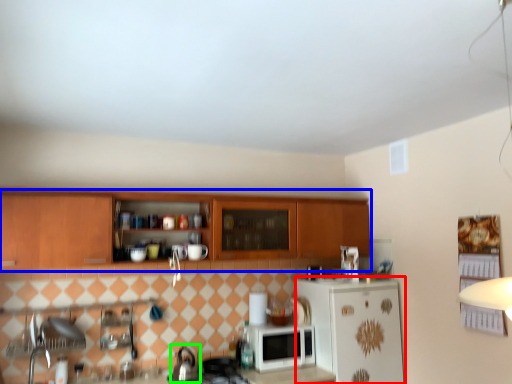
Question: Which is farther away from refrigerator (highlighted by a red box)? cabinetry (highlighted by a blue box) or tea pot (highlighted by a green box)?

Choices:
 (A) cabinetry
 (B) tea pot

Answer: (B)